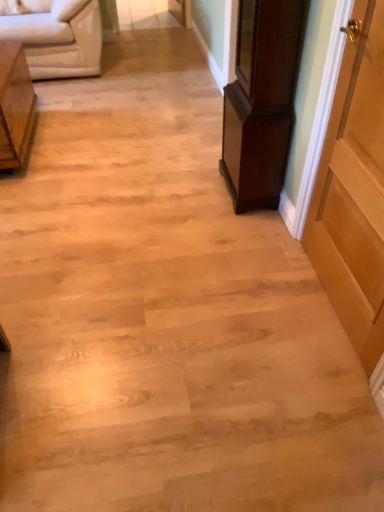
Question: Is dark wood cabinet at right, which is counted as the first furniture, starting from the right, next to light brown wood door at right?

Choices:
 (A) no
 (B) yes

Answer: (A)

Question: From a real-world perspective, is dark wood cabinet at right, which ranks as the 2th furniture in left-to-right order, beneath light brown wood door at right?

Choices:
 (A) no
 (B) yes

Answer: (B)

Question: Is dark wood cabinet at right, which ranks as the 2th furniture in left-to-right order, located outside light brown wood door at right?

Choices:
 (A) yes
 (B) no

Answer: (A)

Question: Is the position of dark wood cabinet at right, which is counted as the first furniture, starting from the right, more distant than that of light brown wood door at right?

Choices:
 (A) no
 (B) yes

Answer: (B)

Question: Does dark wood cabinet at right, which ranks as the 2th furniture in left-to-right order, have a lesser width compared to light brown wood door at right?

Choices:
 (A) yes
 (B) no

Answer: (B)

Question: From their relative heights in the image, would you say light brown wood side table at left, the 1th furniture when ordered from left to right, is taller or shorter than dark wood cabinet at right, which ranks as the 2th furniture in left-to-right order?

Choices:
 (A) short
 (B) tall

Answer: (A)

Question: Is point (3, 95) closer or farther from the camera than point (274, 57)?

Choices:
 (A) closer
 (B) farther

Answer: (B)

Question: Visually, is light brown wood side table at left, marked as the 2th furniture in a right-to-left arrangement, positioned to the left or to the right of dark wood cabinet at right, which ranks as the 2th furniture in left-to-right order?

Choices:
 (A) right
 (B) left

Answer: (B)

Question: Considering their positions, is light brown wood side table at left, marked as the 2th furniture in a right-to-left arrangement, located in front of or behind dark wood cabinet at right, which ranks as the 2th furniture in left-to-right order?

Choices:
 (A) behind
 (B) front

Answer: (A)

Question: In terms of height, does light brown wood door at right look taller or shorter compared to white leather studio couch at upper left?

Choices:
 (A) tall
 (B) short

Answer: (A)

Question: From a real-world perspective, is light brown wood door at right physically located above or below white leather studio couch at upper left?

Choices:
 (A) below
 (B) above

Answer: (B)

Question: Is light brown wood door at right in front of or behind white leather studio couch at upper left in the image?

Choices:
 (A) front
 (B) behind

Answer: (A)

Question: Looking at their shapes, would you say light brown wood door at right is wider or thinner than white leather studio couch at upper left?

Choices:
 (A) thin
 (B) wide

Answer: (A)

Question: From the image's perspective, relative to white leather studio couch at upper left, is light brown wood side table at left, the 1th furniture when ordered from left to right, above or below?

Choices:
 (A) above
 (B) below

Answer: (B)

Question: Is light brown wood side table at left, the 1th furniture when ordered from left to right, to the left or to the right of white leather studio couch at upper left in the image?

Choices:
 (A) left
 (B) right

Answer: (B)